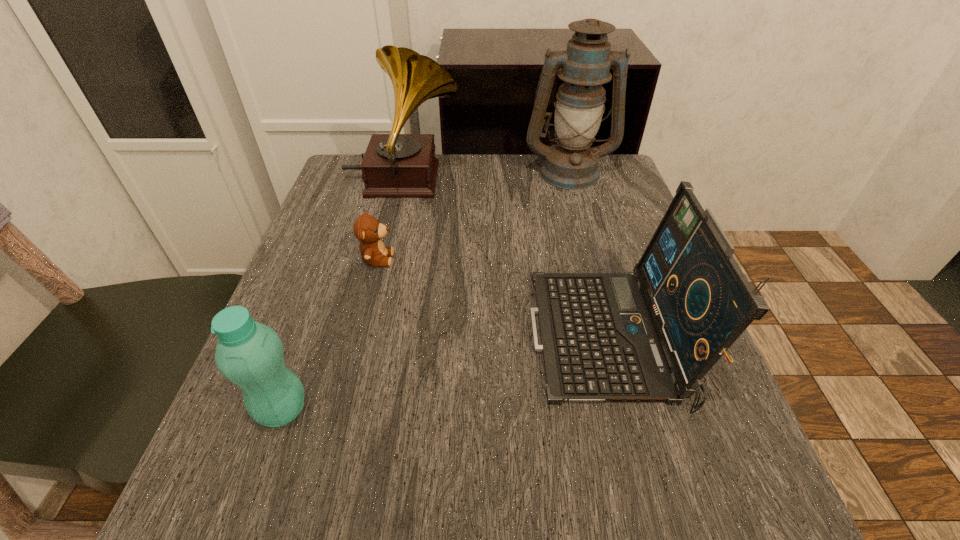
In order to click on oil lamp in this screenshot , I will do `click(585, 65)`.

In order to click on phonograph record in this screenshot , I will do `click(394, 165)`.

The width and height of the screenshot is (960, 540). Find the location of `laptop computer`. laptop computer is located at coordinates (651, 335).

Find the location of `bottle`. bottle is located at coordinates (249, 354).

Locate an element on the screen. The image size is (960, 540). teddy bear is located at coordinates (367, 229).

The height and width of the screenshot is (540, 960). I want to click on the third nearest object, so click(x=367, y=229).

You are a GUI agent. You are given a task and a screenshot of the screen. Output one action in this format:
    pyautogui.click(x=<x>, y=<y>)
    Task: Click on the free space located on the front of the oil lamp
    
    Given the screenshot: What is the action you would take?
    pyautogui.click(x=583, y=221)

You are a GUI agent. You are given a task and a screenshot of the screen. Output one action in this format:
    pyautogui.click(x=<x>, y=<y>)
    Task: Click on the vacant space located from the horn of the phonograph record
    Image resolution: width=960 pixels, height=540 pixels.
    Given the screenshot: What is the action you would take?
    pyautogui.click(x=504, y=181)

Locate an element on the screen. This screenshot has height=540, width=960. vacant region located on the front-facing side of the laptop computer is located at coordinates pyautogui.click(x=410, y=339).

This screenshot has height=540, width=960. What are the coordinates of `vacant space positioned on the front-facing side of the laptop computer` in the screenshot? It's located at (341, 339).